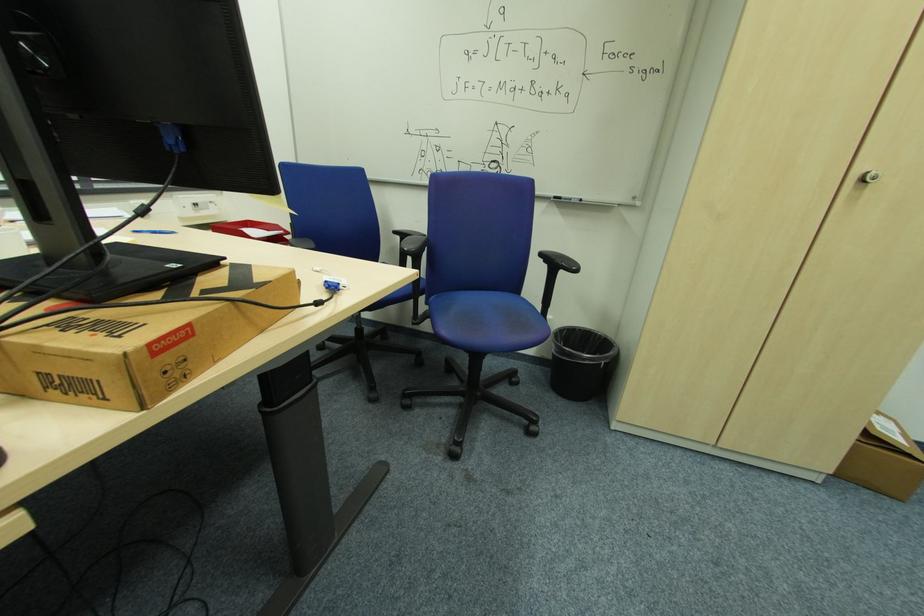
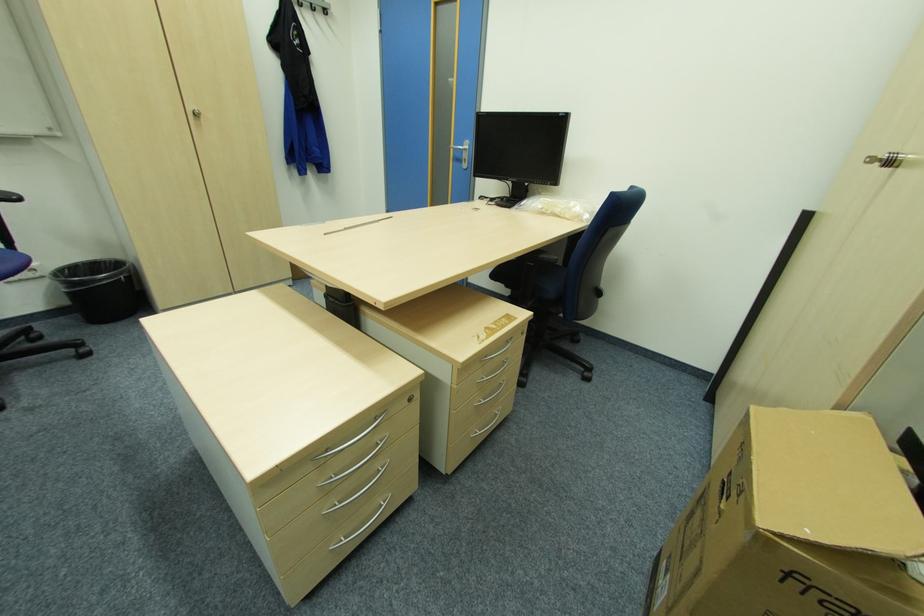
Where in the second image is the point corresponding to the point at 602,336 from the first image?

(113, 261)